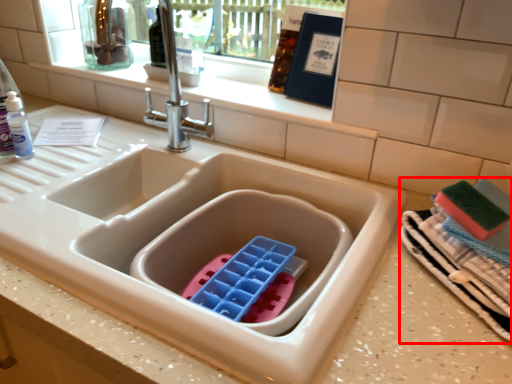
Question: From the image's perspective, what is the correct spatial positioning of laundry (annotated by the red box) in reference to tap?

Choices:
 (A) above
 (B) below

Answer: (B)